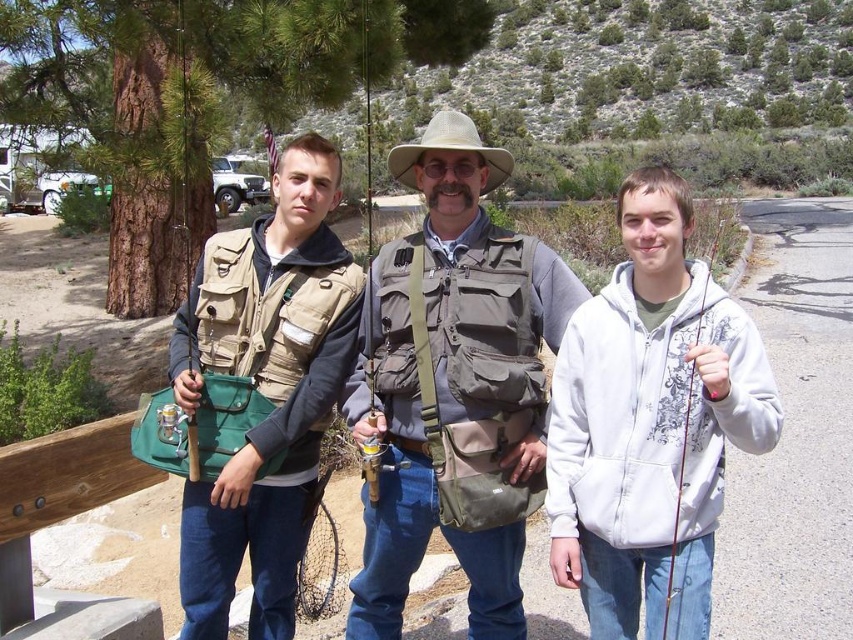
Question: Which point is closer to the camera?

Choices:
 (A) (672, 524)
 (B) (473, 124)
 (C) (486, 588)

Answer: (A)

Question: Can you confirm if tan fabric vest at center is wider than tan canvas cowboy hat at center?

Choices:
 (A) no
 (B) yes

Answer: (A)

Question: Which point is farther to the camera?

Choices:
 (A) tan fabric vest at center
 (B) white fleece hoodie at right
 (C) tan canvas cowboy hat at center
 (D) matte khaki vest at center

Answer: (C)

Question: Which point appears closest to the camera in this image?

Choices:
 (A) (401, 168)
 (B) (680, 472)
 (C) (480, 580)
 (D) (462, 301)

Answer: (B)

Question: Observing the image, what is the correct spatial positioning of tan canvas cowboy hat at center in reference to matte brown fishing pole at right?

Choices:
 (A) right
 (B) left

Answer: (B)

Question: Does white fleece hoodie at right have a smaller size compared to tan canvas cowboy hat at center?

Choices:
 (A) no
 (B) yes

Answer: (B)